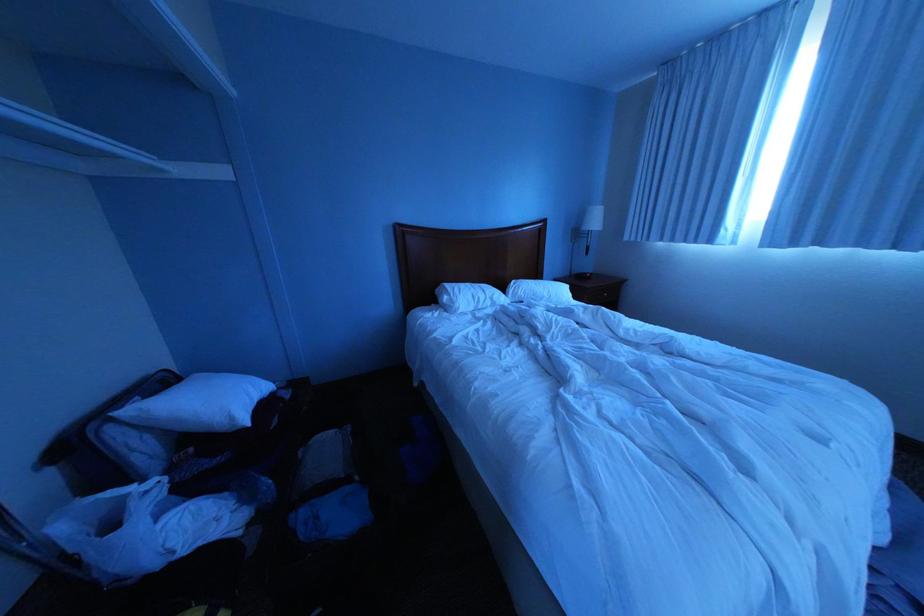
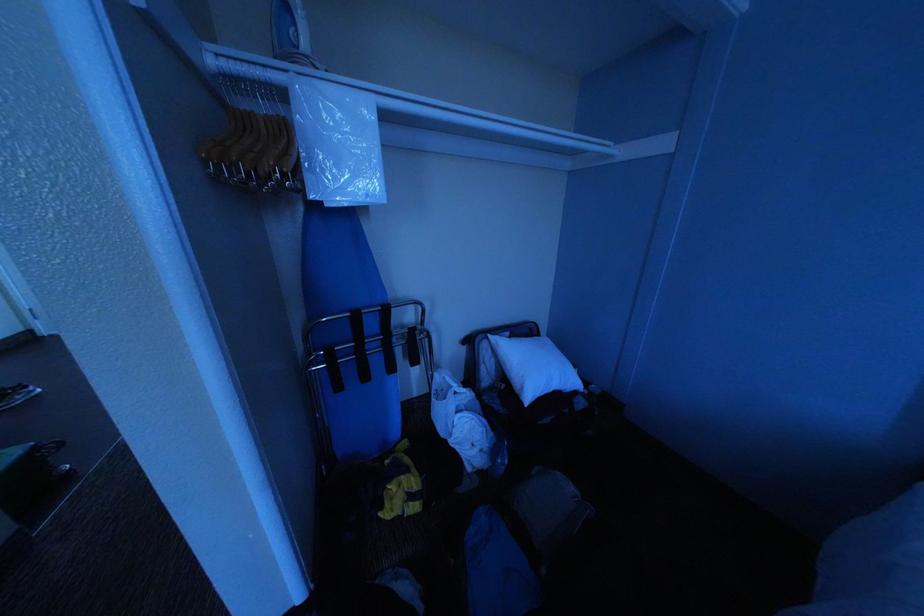
How did the camera likely rotate?

The camera's rotation is toward left-down.